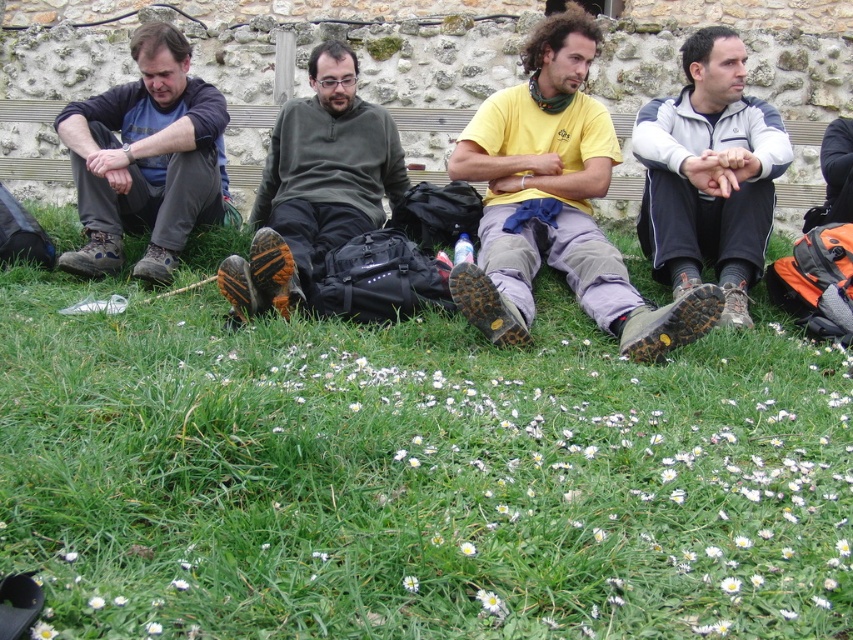
Is yellow matte shirt at center positioned in front of dark green fabric pants at center?

Yes.

The image size is (853, 640). I want to click on yellow matte shirt at center, so click(x=555, y=204).

Find the location of `yellow matte shirt at center`. yellow matte shirt at center is located at coordinates (555, 204).

Who is shorter, yellow matte shirt at center or gray fleece jacket at right?

gray fleece jacket at right is shorter.

Which is behind, point (486, 170) or point (657, 253)?

Positioned behind is point (486, 170).

Locate an element on the screen. Image resolution: width=853 pixels, height=640 pixels. yellow matte shirt at center is located at coordinates coord(555,204).

Can you confirm if green grass at lower center is positioned below yellow matte shirt at center?

Yes.

Is point (10, 314) more distant than point (494, 256)?

No, it is not.

Image resolution: width=853 pixels, height=640 pixels. I want to click on green grass at lower center, so click(x=415, y=474).